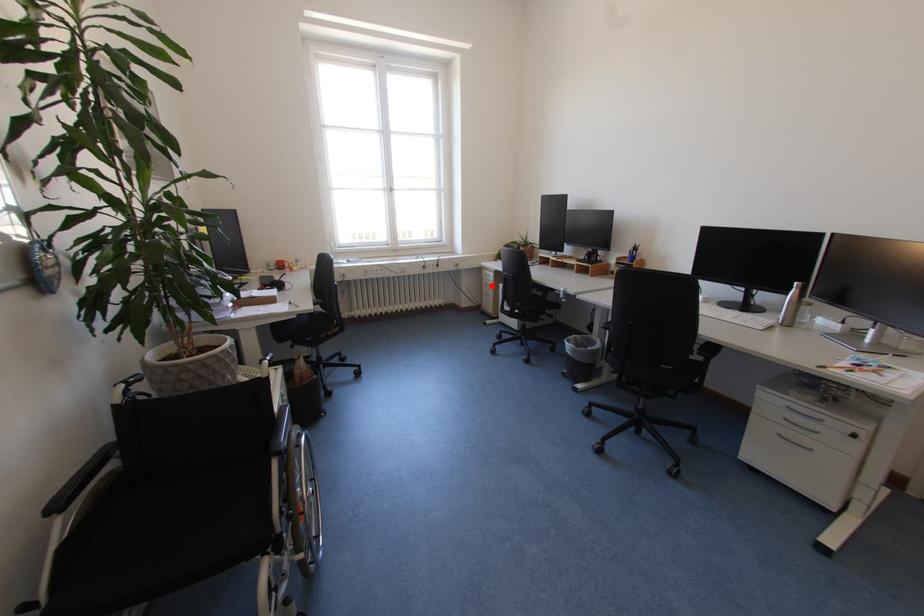
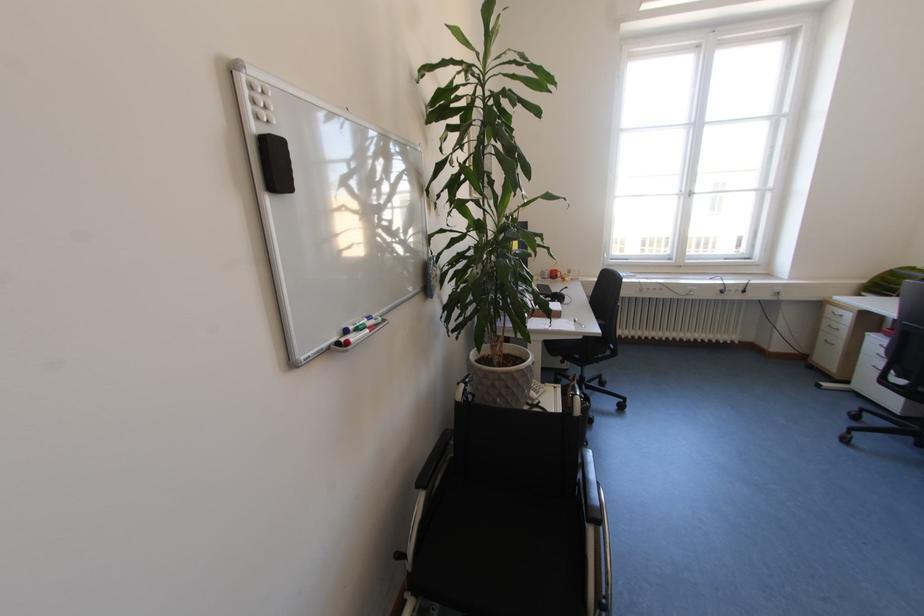
Question: I am providing you with two images of the same scene from different viewpoints. Given a red point in image1, look at the same physical point in image2. Is it:

Choices:
 (A) Closer to the viewpoint
 (B) Farther from the viewpoint

Answer: (B)